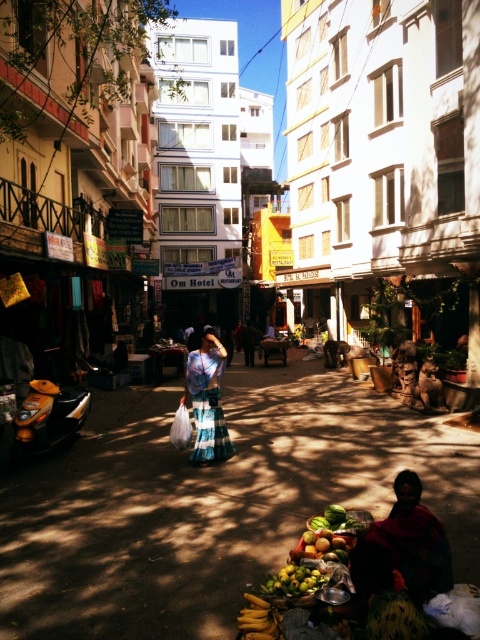
Question: Which of the following is the closest to the observer?

Choices:
 (A) (330, 534)
 (B) (101, 557)

Answer: (A)

Question: Does green matte mangoes at lower center appear over shiny green melon at lower center?

Choices:
 (A) yes
 (B) no

Answer: (B)

Question: Based on their relative distances, which object is nearer to the matte blue dress at center?

Choices:
 (A) shiny green melon at lower center
 (B) blue plaid skirt at center

Answer: (A)

Question: From the image, what is the correct spatial relationship of matte blue dress at center in relation to blue plaid skirt at center?

Choices:
 (A) left
 (B) right

Answer: (B)

Question: Among these objects, which one is farthest from the camera?

Choices:
 (A) green matte mangoes at lower center
 (B) blue plaid skirt at center

Answer: (B)

Question: Is blue plaid skirt at center in front of green matte mangoes at lower center?

Choices:
 (A) yes
 (B) no

Answer: (B)